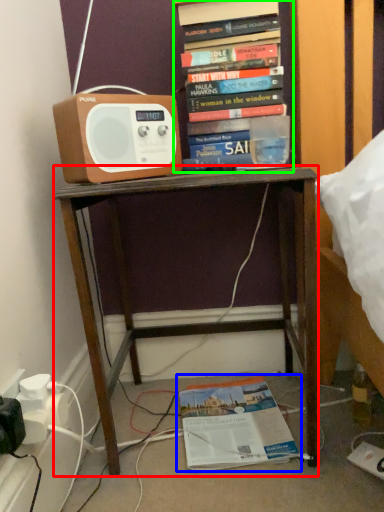
Question: Which is farther away from desk (highlighted by a red box)? book (highlighted by a blue box) or book (highlighted by a green box)?

Choices:
 (A) book
 (B) book

Answer: (B)